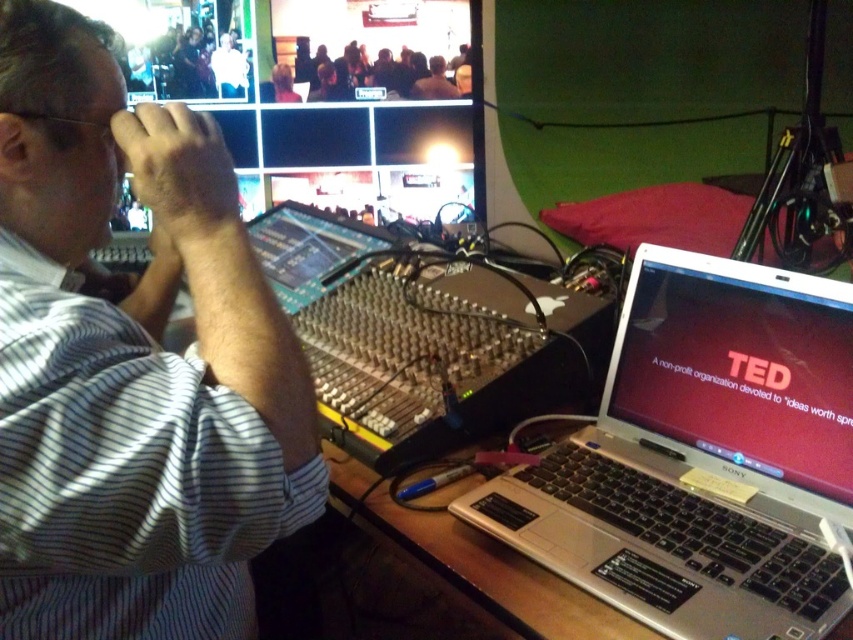
Which of these two, white striped shirt at upper left or matte silver laptop at right, stands taller?

white striped shirt at upper left

Is white striped shirt at upper left bigger than matte silver laptop at right?

Yes.

Which is behind, point (137, 442) or point (605, 413)?

The point (605, 413) is more distant.

Find the location of a particular element. The height and width of the screenshot is (640, 853). white striped shirt at upper left is located at coordinates (132, 364).

In the scene shown: Is white striped shirt at upper left positioned in front of wooden table at lower right?

Yes, it is in front of wooden table at lower right.

Can you confirm if white striped shirt at upper left is positioned below wooden table at lower right?

Incorrect, white striped shirt at upper left is not positioned below wooden table at lower right.

Consider the image. Measure the distance between point (x=294, y=336) and camera.

The distance of point (x=294, y=336) from camera is 23.54 inches.

Find the location of a particular element. white striped shirt at upper left is located at coordinates (132, 364).

Can you confirm if white striped shirt at upper left is bigger than silver metallic laptop at right?

Correct, white striped shirt at upper left is larger in size than silver metallic laptop at right.

Can you confirm if white striped shirt at upper left is positioned to the left of silver metallic laptop at right?

Indeed, white striped shirt at upper left is positioned on the left side of silver metallic laptop at right.

I want to click on white striped shirt at upper left, so click(x=132, y=364).

Locate an element on the screen. The width and height of the screenshot is (853, 640). white striped shirt at upper left is located at coordinates (132, 364).